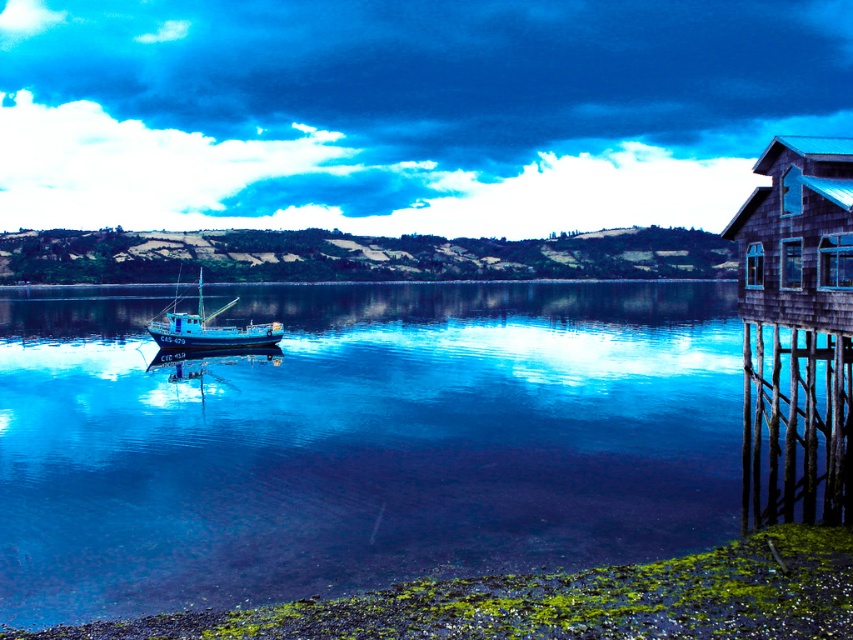
Does wooden cabin at right come in front of blue matte fishing boat at center?

Yes, wooden cabin at right is in front of blue matte fishing boat at center.

Can you confirm if wooden cabin at right is thinner than blue matte fishing boat at center?

Indeed, wooden cabin at right has a lesser width compared to blue matte fishing boat at center.

Is point (833, 236) positioned before point (190, 346)?

That is True.

I want to click on wooden cabin at right, so click(x=798, y=236).

Is green mossy gravel at lower left bigger than blue matte fishing boat at center?

Incorrect, green mossy gravel at lower left is not larger than blue matte fishing boat at center.

Based on the photo, between green mossy gravel at lower left and blue matte fishing boat at center, which one is positioned lower?

green mossy gravel at lower left

Describe the element at coordinates (560, 602) in the screenshot. This screenshot has height=640, width=853. I see `green mossy gravel at lower left` at that location.

Locate an element on the screen. green mossy gravel at lower left is located at coordinates (560, 602).

Which is behind, point (445, 582) or point (744, 317)?

The point (744, 317) is more distant.

The width and height of the screenshot is (853, 640). What do you see at coordinates (560, 602) in the screenshot?
I see `green mossy gravel at lower left` at bounding box center [560, 602].

Where is `green mossy gravel at lower left`? green mossy gravel at lower left is located at coordinates (560, 602).